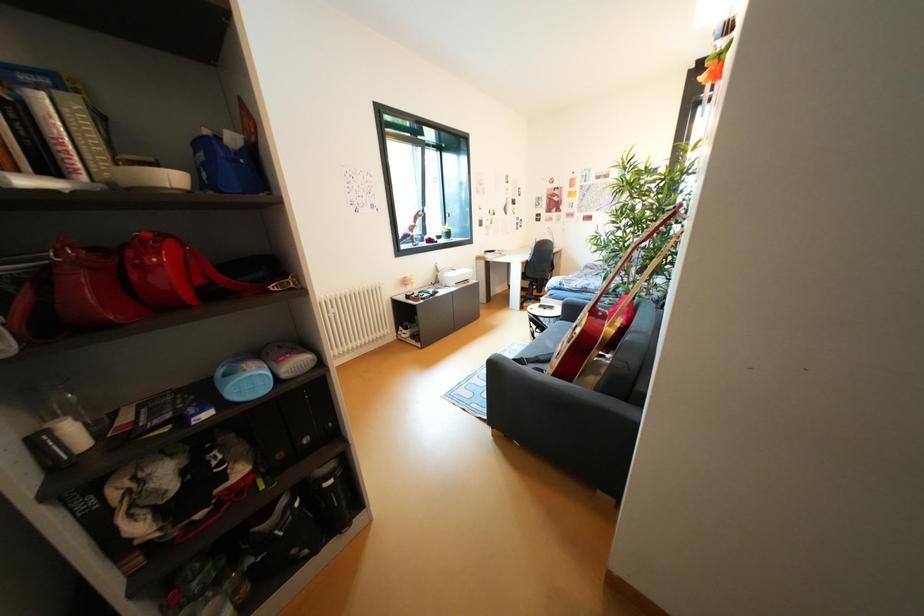
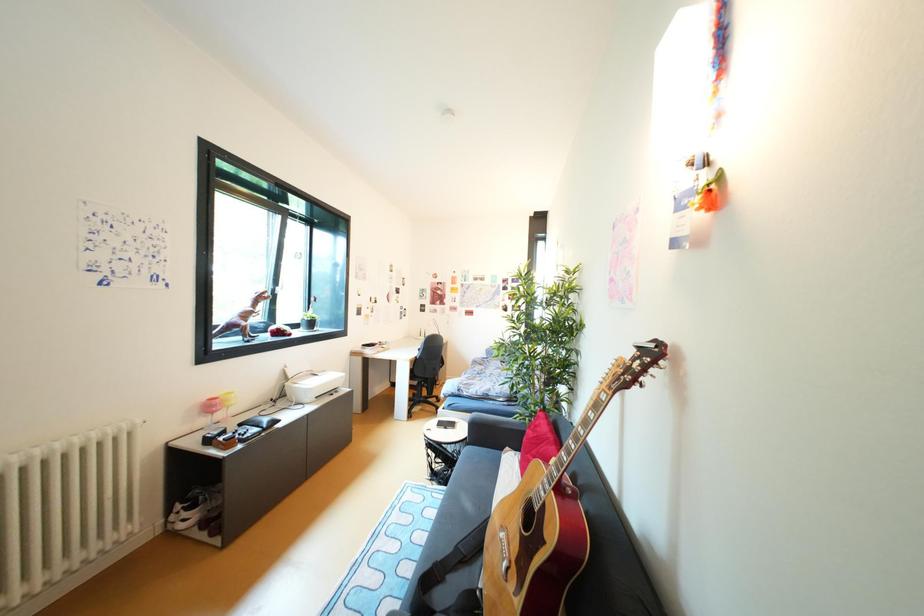
First-person continuous shooting, in which direction is the camera rotating?

The rotation direction of the camera is right-up.